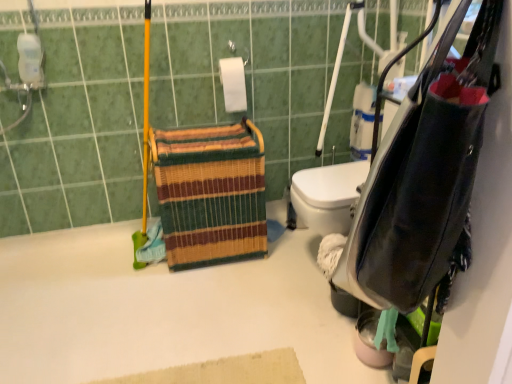
Identify the location of vacant space that is to the left of multicolored woven basket at center. Image resolution: width=512 pixels, height=384 pixels. (113, 277).